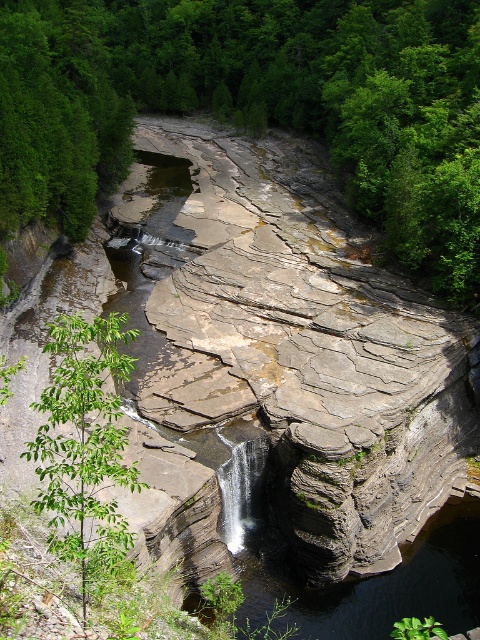
Question: Among these objects, which one is nearest to the camera?

Choices:
 (A) green leafy tree at center-left
 (B) green leafy tree at lower left

Answer: (B)

Question: Can you confirm if green leafy tree at center-left is positioned above green leafy tree at lower left?

Choices:
 (A) no
 (B) yes

Answer: (B)

Question: Can you confirm if green leafy tree at center-left is bigger than green leafy tree at lower left?

Choices:
 (A) no
 (B) yes

Answer: (B)

Question: Which object is closer to the camera taking this photo?

Choices:
 (A) green leafy tree at center-left
 (B) green leafy tree at lower left

Answer: (B)

Question: From the image, what is the correct spatial relationship of green leafy tree at center-left in relation to green leafy tree at lower left?

Choices:
 (A) above
 (B) below

Answer: (A)